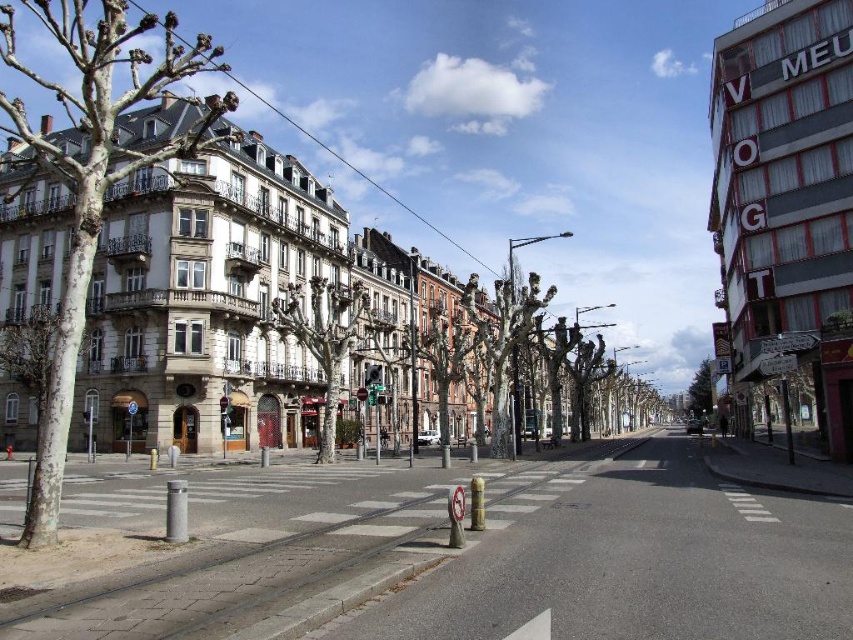
You are standing at the intersection of the street and want to locate the bare wood tree at center. According to the coordinates provided, where should you look?

The bare wood tree at center is located at coordinates point (323, 339).

You are a pedestrian standing on the sidewalk looking towards the street. You notice two trees, the smooth bark tree at left and the smooth brown tree at center. Which tree appears higher in the image?

The smooth bark tree at left appears higher in the image because it is located above the smooth brown tree at center.

In the scene shown: You are a city planner evaluating the spacing between trees along a pedestrian walkway. The smooth bark tree at left and the bare bark tree at center are part of the current design. According to the city regulations, trees must be spaced at least 100 meters apart for proper growth. Does the current spacing between these two trees meet the regulation?

The distance between the smooth bark tree at left and the bare bark tree at center is 123.60 meters, which exceeds the minimum requirement of 100 meters. Therefore, the spacing between these two trees meets the city regulations.